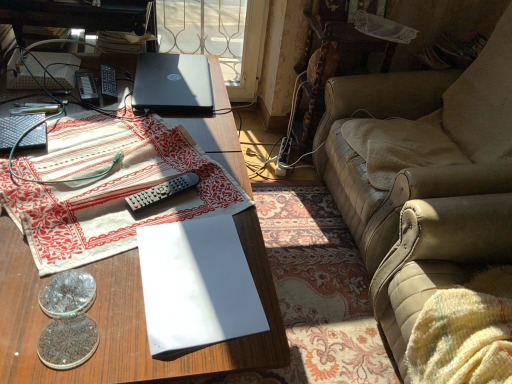
At what (x,y) coordinates should I click in order to perform the action: click on free space between black plastic remote control at center, which appears as the first remote control when viewed from the back, and shiny metallic coin at lower left, placed as the second coin when sorted from front to back. Please return your answer as a coordinate pair (x, y). This screenshot has width=512, height=384. Looking at the image, I should click on (90, 173).